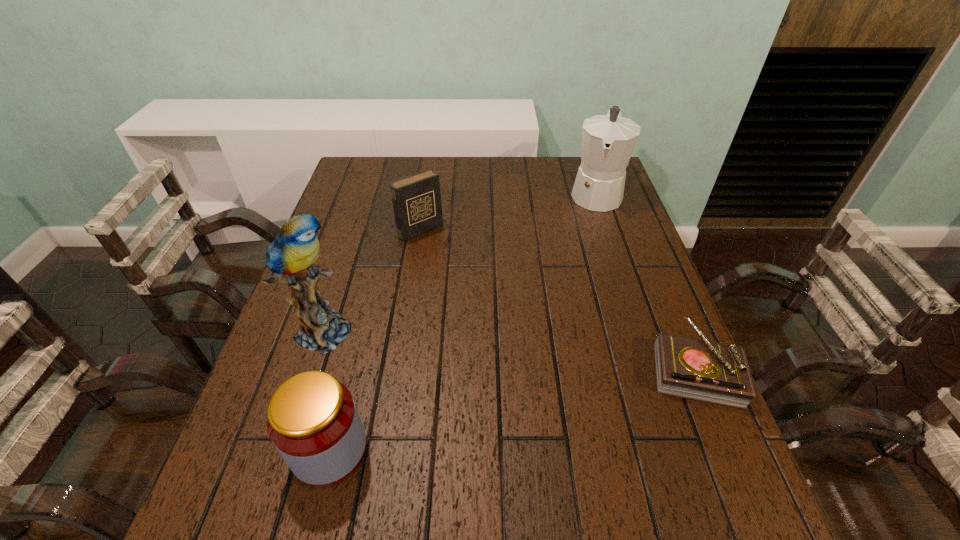
Where is `free location at the right edge of the desktop`? Image resolution: width=960 pixels, height=540 pixels. free location at the right edge of the desktop is located at coordinates (618, 318).

I want to click on vacant space at the far left corner, so click(x=361, y=158).

Identify the location of free space at the far right corner. This screenshot has height=540, width=960. (573, 169).

The width and height of the screenshot is (960, 540). I want to click on vacant space in between the fourth nearest object and the farthest object, so click(x=508, y=212).

Where is `vacant space in between the parrot and the shortest object`? The height and width of the screenshot is (540, 960). vacant space in between the parrot and the shortest object is located at coordinates (511, 348).

Locate an element on the screen. The image size is (960, 540). free point between the taller diary and the jar is located at coordinates tap(375, 340).

Locate an element on the screen. vacant area that lies between the nearer diary and the nearest object is located at coordinates (512, 409).

Locate an element on the screen. Image resolution: width=960 pixels, height=540 pixels. free space between the farthest object and the shorter diary is located at coordinates (645, 281).

At what (x,y) coordinates should I click in order to perform the action: click on free area in between the shorter diary and the jar. Please return your answer as a coordinate pair (x, y). The image size is (960, 540). Looking at the image, I should click on (512, 409).

The image size is (960, 540). I want to click on object that stands as the closest to the nearest object, so click(290, 257).